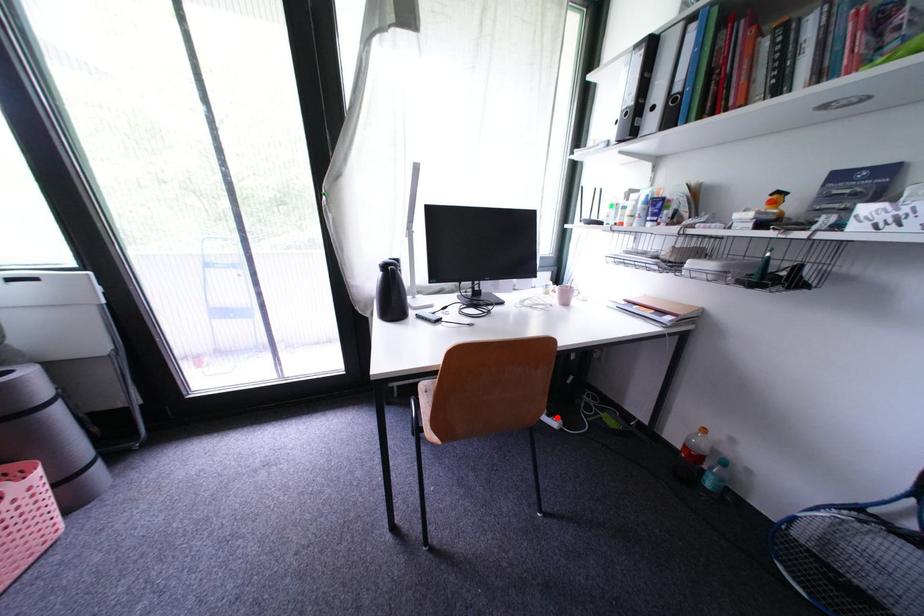
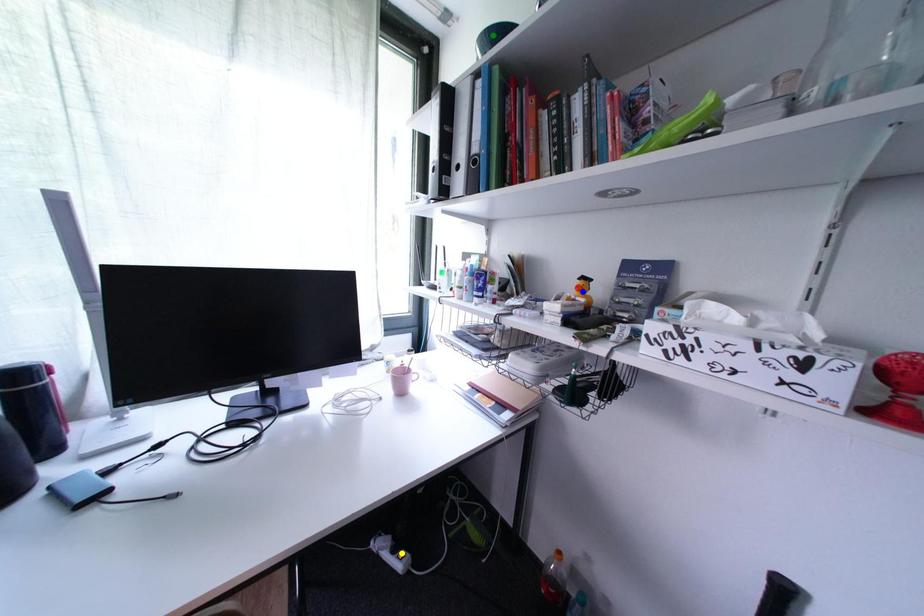
Question: I am providing you with two images of the same scene from different viewpoints. A red point is marked on the first image. You are given multiple points on the second image. Which spot in image 2 lines up with the point in image 1?

Choices:
 (A) yellow point
 (B) blue point
 (C) green point

Answer: (A)